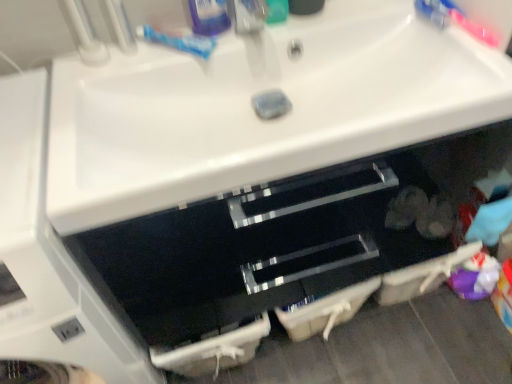
The image size is (512, 384). In order to click on vacant area situated below white glossy sink at center (from a real-world perspective) in this screenshot , I will do `click(285, 273)`.